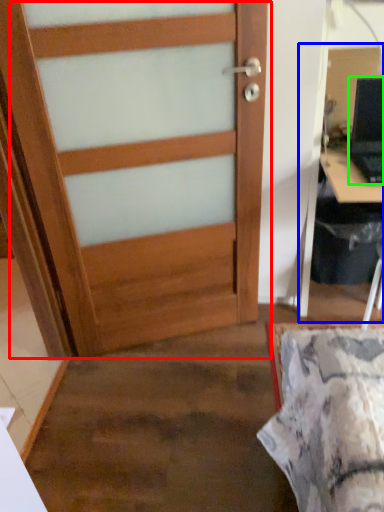
Question: Which object is positioned closest to door (highlighted by a red box)? Select from computer desk (highlighted by a blue box) and laptop (highlighted by a green box).

Choices:
 (A) computer desk
 (B) laptop

Answer: (A)